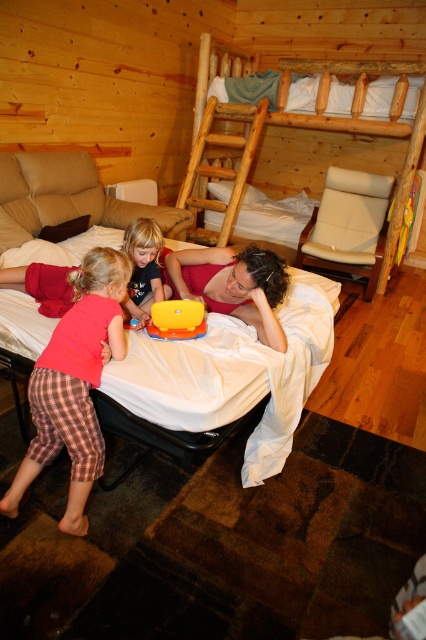
Where is `white soft mattress at center`? The image size is (426, 640). white soft mattress at center is located at coordinates (233, 374).

Based on the photo, is white soft mattress at center below wooden ladder at center?

Yes, white soft mattress at center is below wooden ladder at center.

Image resolution: width=426 pixels, height=640 pixels. Describe the element at coordinates (233, 374) in the screenshot. I see `white soft mattress at center` at that location.

The width and height of the screenshot is (426, 640). In order to click on white soft mattress at center in this screenshot , I will do `click(233, 374)`.

How distant is matte red dress at center from white soft pillow at upper center?

matte red dress at center is 2.92 meters away from white soft pillow at upper center.

Is matte red dress at center thinner than white soft pillow at upper center?

Yes.

Does point (219, 298) come closer to viewer compared to point (247, 202)?

Yes, point (219, 298) is in front of point (247, 202).

Locate an element on the screen. This screenshot has width=426, height=640. matte red dress at center is located at coordinates (232, 285).

Is plaid cotton pants at lower left taller than yellow plastic toy at center?

Correct, plaid cotton pants at lower left is much taller as yellow plastic toy at center.

Does plaid cotton pants at lower left appear on the right side of yellow plastic toy at center?

No, plaid cotton pants at lower left is not to the right of yellow plastic toy at center.

Who is more distant from viewer, (39, 432) or (187, 321)?

The point (187, 321) is more distant.

The height and width of the screenshot is (640, 426). Find the location of `plaid cotton pants at lower left`. plaid cotton pants at lower left is located at coordinates (74, 384).